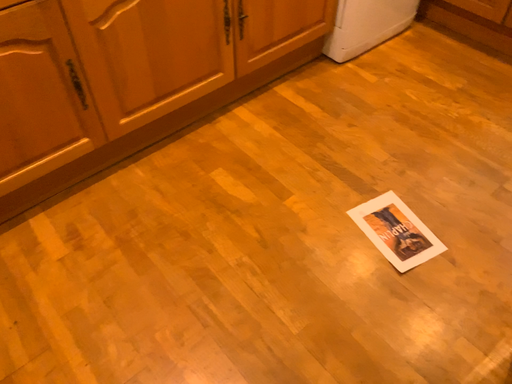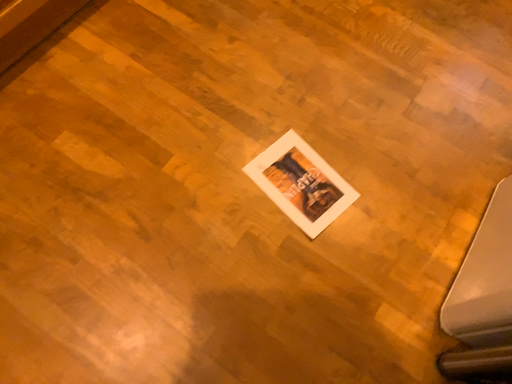
Question: How did the camera likely rotate when shooting the video?

Choices:
 (A) rotated downward
 (B) rotated upward

Answer: (A)